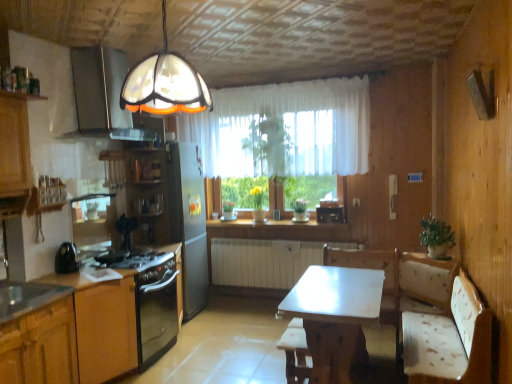
Locate an element on the screen. Image resolution: width=512 pixels, height=384 pixels. empty space that is ontop of white glossy table at center (from a real-world perspective) is located at coordinates (323, 284).